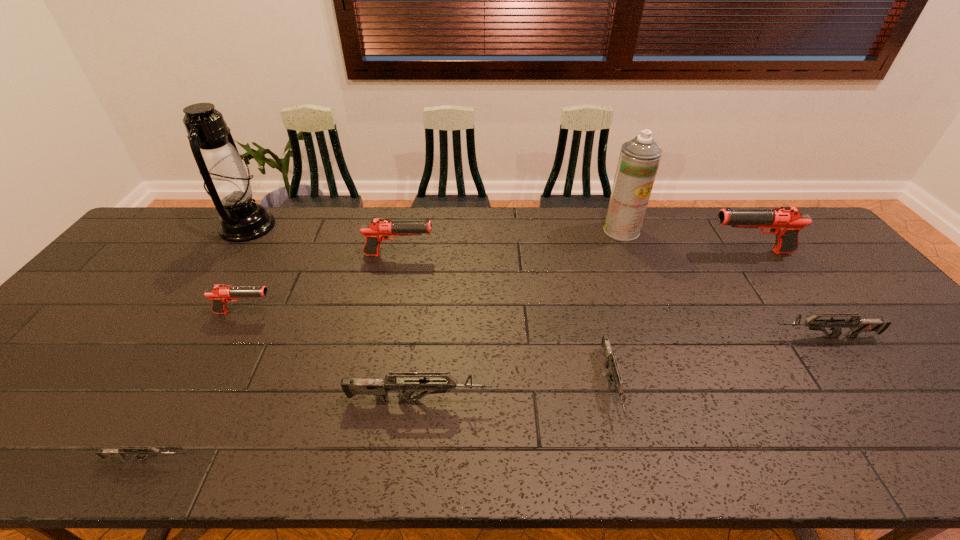
Where is `free area in between the second shortest gun and the black oil lamp`? This screenshot has width=960, height=540. free area in between the second shortest gun and the black oil lamp is located at coordinates (430, 305).

Where is `free space that is in between the biggest black gun and the third smallest grey gun`? free space that is in between the biggest black gun and the third smallest grey gun is located at coordinates (787, 294).

What are the coordinates of `free spot between the second shortest object and the aerosol can` in the screenshot? It's located at (616, 307).

This screenshot has height=540, width=960. I want to click on free space that is in between the rightmost grey gun and the biggest grey gun, so click(x=622, y=368).

Where is `vacant area between the shortest object and the tallest gun`? This screenshot has width=960, height=540. vacant area between the shortest object and the tallest gun is located at coordinates (447, 356).

In order to click on vacant region between the fifth gun from left to right and the second biggest grey gun in this screenshot , I will do `click(718, 360)`.

The image size is (960, 540). In order to click on vacant point located between the leftmost black gun and the second biggest black gun in this screenshot , I will do `click(322, 284)`.

Where is `empty space between the nearest black gun and the eighth shortest object`? The width and height of the screenshot is (960, 540). empty space between the nearest black gun and the eighth shortest object is located at coordinates (433, 272).

Locate an element on the screen. This screenshot has height=540, width=960. the fifth closest object to the nearest object is located at coordinates (610, 359).

Identify which object is the nearest to the oil lamp. Please provide its 2D coordinates. Your answer should be formatted as a tuple, i.e. [(x, y)], where the tuple contains the x and y coordinates of a point satisfying the conditions above.

[(220, 294)]